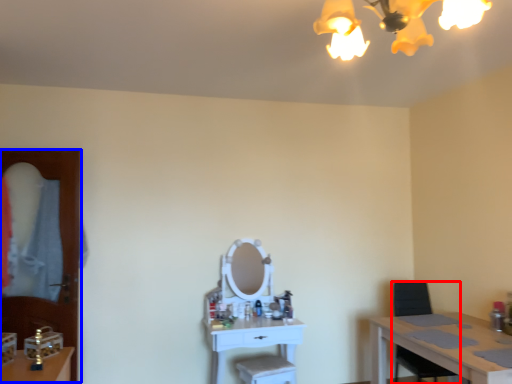
Question: Which object appears closest to the camera in this image, armchair (highlighted by a red box) or glass door (highlighted by a blue box)?

Choices:
 (A) armchair
 (B) glass door

Answer: (A)